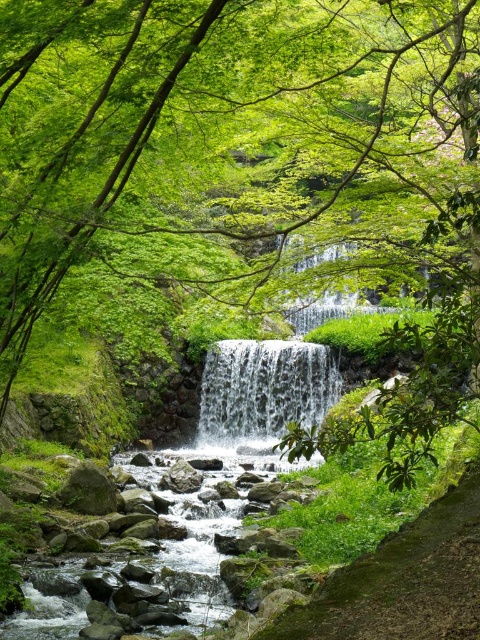
Question: Does green mossy rocks at center appear on the right side of clear water at center?

Choices:
 (A) no
 (B) yes

Answer: (A)

Question: Is green mossy rocks at center wider than clear water at center?

Choices:
 (A) yes
 (B) no

Answer: (A)

Question: Is green mossy rocks at center bigger than clear water at center?

Choices:
 (A) no
 (B) yes

Answer: (A)

Question: Which point is closer to the camera taking this photo?

Choices:
 (A) (282, 349)
 (B) (212, 484)

Answer: (B)

Question: Which object appears closest to the camera in this image?

Choices:
 (A) clear water at center
 (B) green mossy rocks at center

Answer: (B)